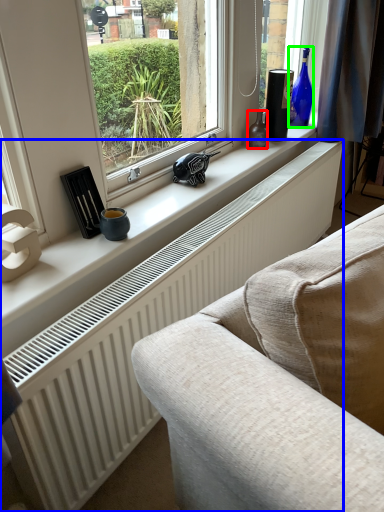
Question: Which object is positioned closest to bottle (highlighted by a red box)? Select from radiator (highlighted by a blue box) and bottle (highlighted by a green box).

Choices:
 (A) radiator
 (B) bottle

Answer: (B)